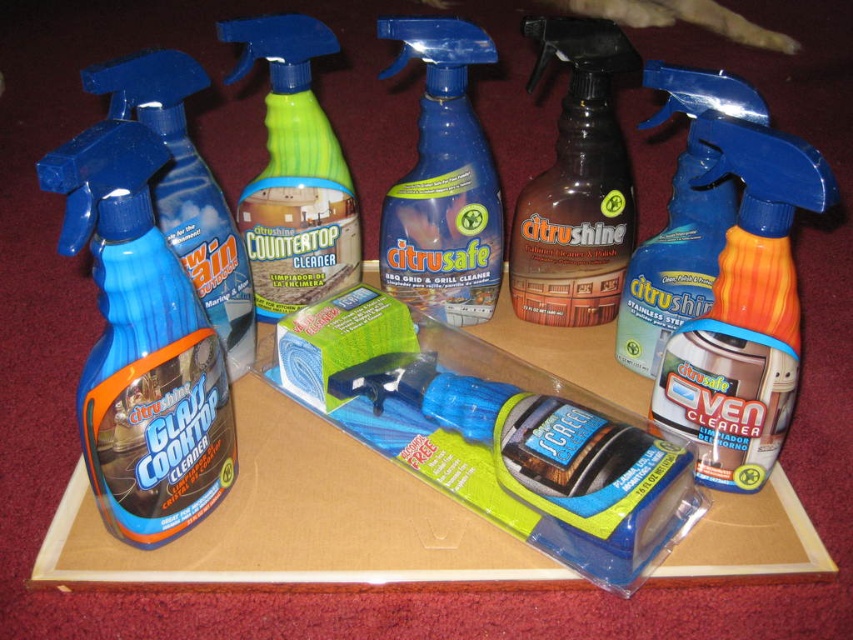
You are organizing the cleaning products on the cardboard tray. You need to place the blue plastic oven cleaner at center right and the brown matte cleaner at center in a way that follows the arrangement shown. Which cleaner should be placed lower on the tray?

The blue plastic oven cleaner at center right should be placed lower on the tray because it is positioned below the brown matte cleaner at center in the original arrangement.

You are organizing a store shelf and need to place the blue plastic oven cleaner at center right and the brown matte cleaner at center. Since the blue plastic oven cleaner is in front, which one should you position closer to the customer viewing the shelf?

The blue plastic oven cleaner at center right should be positioned closer to the customer since it is in front of the brown matte cleaner at center.